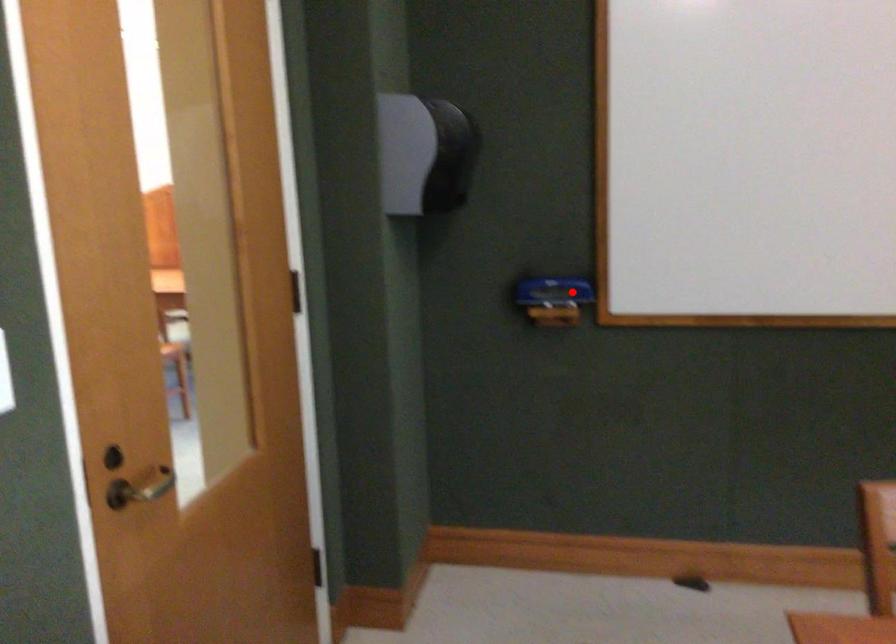
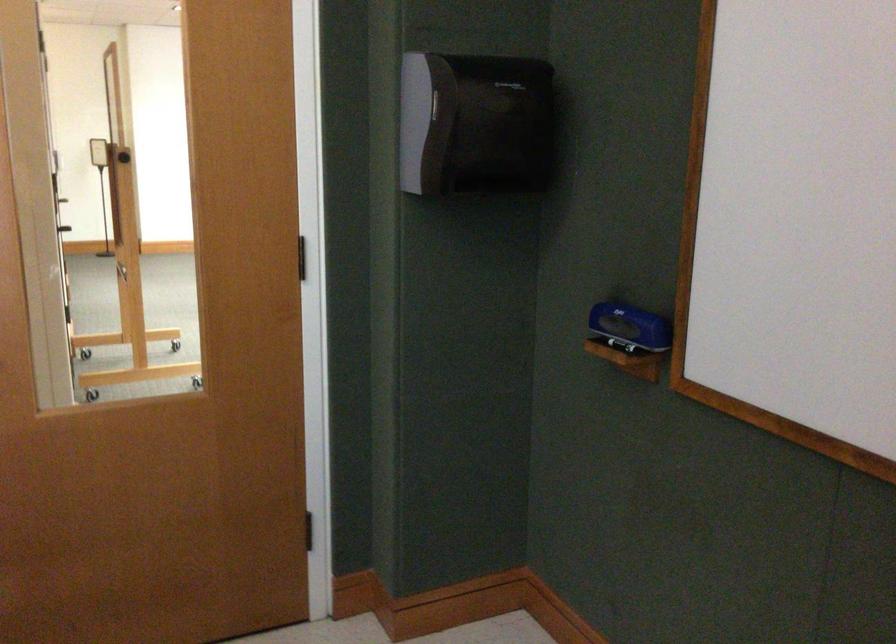
Where in the second image is the point corresponding to the highlighted location from the first image?

(630, 327)